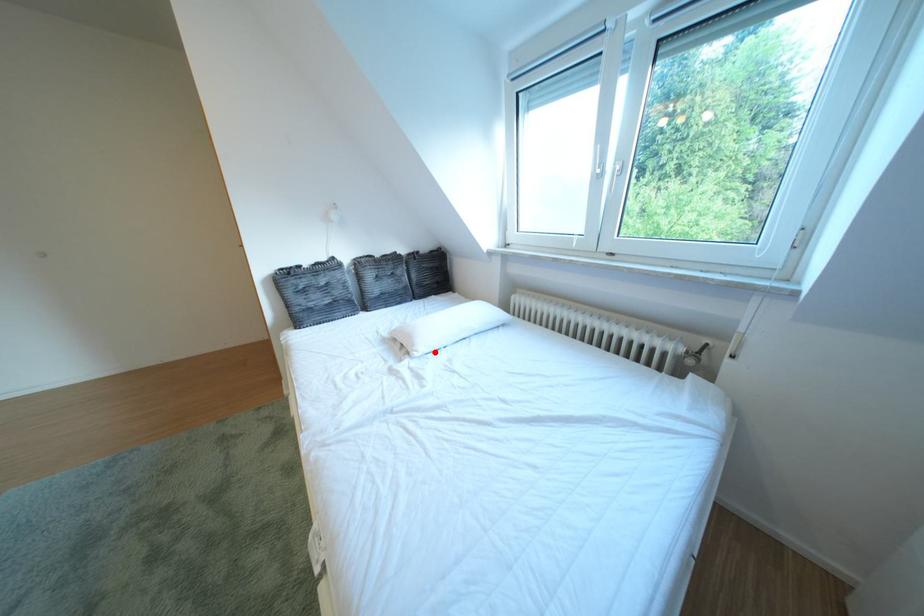
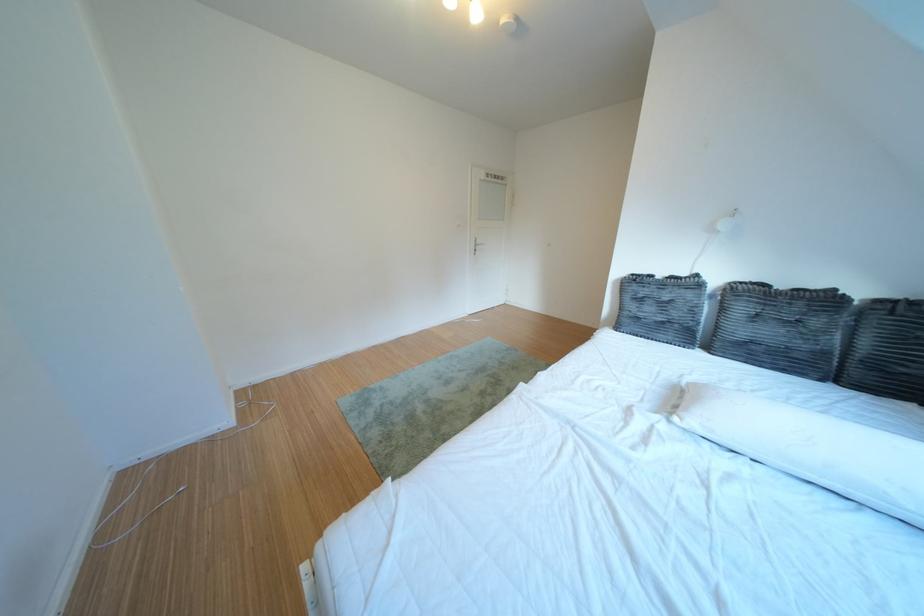
In the second image, find the point that corresponds to the highlighted location in the first image.

(707, 424)